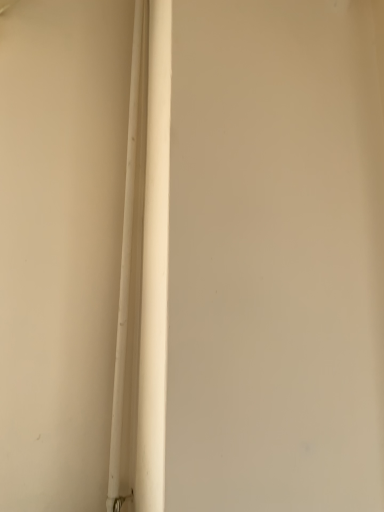
This screenshot has height=512, width=384. In order to click on white matte pipe at center in this screenshot , I will do `click(129, 276)`.

What do you see at coordinates (129, 276) in the screenshot? I see `white matte pipe at center` at bounding box center [129, 276].

Where is `white matte pipe at center`? This screenshot has width=384, height=512. white matte pipe at center is located at coordinates (129, 276).